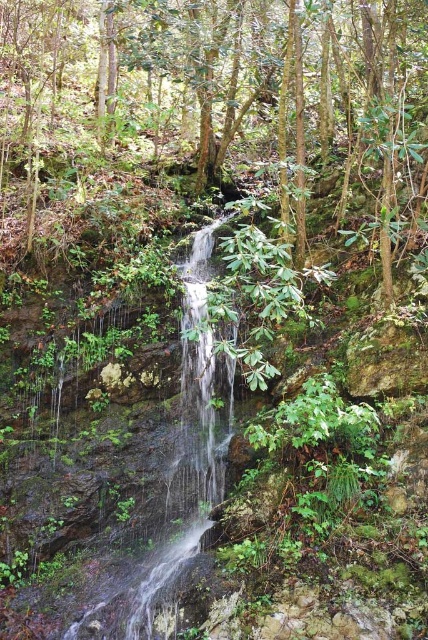
Question: Is green leafy tree at center to the right of clear water at center from the viewer's perspective?

Choices:
 (A) no
 (B) yes

Answer: (B)

Question: Can you confirm if green leafy tree at center is thinner than clear water at center?

Choices:
 (A) no
 (B) yes

Answer: (A)

Question: Is green leafy tree at center below clear water at center?

Choices:
 (A) yes
 (B) no

Answer: (B)

Question: Among these objects, which one is farthest from the camera?

Choices:
 (A) clear water at center
 (B) green leafy tree at center

Answer: (A)